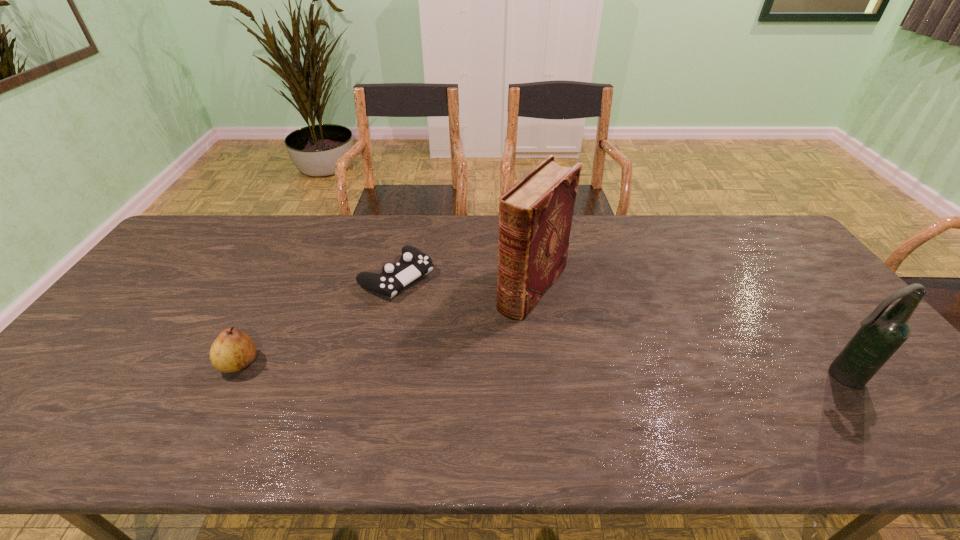
You are a GUI agent. You are given a task and a screenshot of the screen. Output one action in this format:
    pyautogui.click(x=<x>, y=<y>)
    Task: Click on the free space that satisfies the following two spatial constraints: 1. on the front side of the beer bottle; 2. on the right side of the hardback book
    This screenshot has height=540, width=960.
    Given the screenshot: What is the action you would take?
    pyautogui.click(x=544, y=376)

The width and height of the screenshot is (960, 540). I want to click on blank space that satisfies the following two spatial constraints: 1. on the back side of the leftmost object; 2. on the left side of the tallest object, so [278, 287].